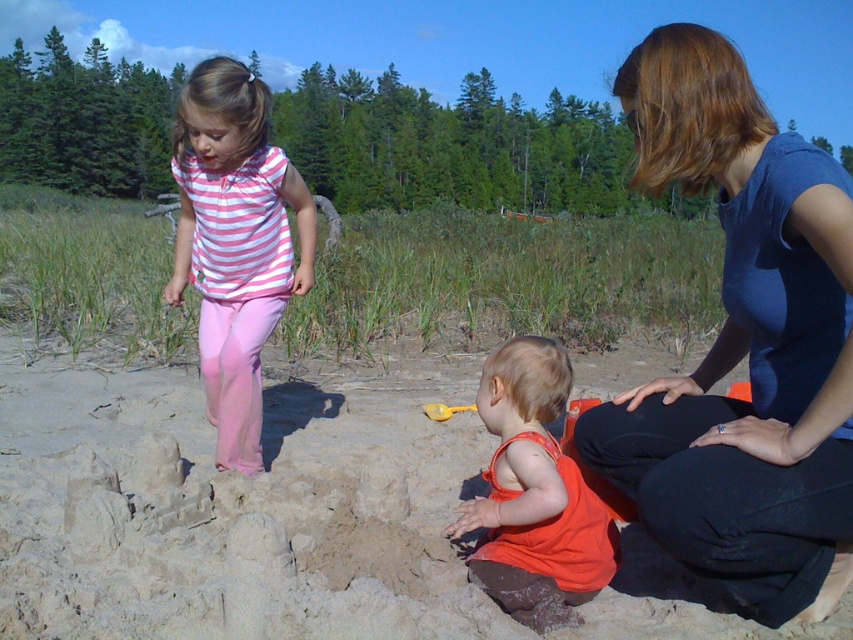
Question: Which is nearer to the orange fabric toddler at center?

Choices:
 (A) pink cotton pants at upper left
 (B) blue fabric dress at center
 (C) yellow plastic shovel at center

Answer: (B)

Question: Which of the following is the closest to the observer?

Choices:
 (A) (202, 104)
 (B) (430, 413)

Answer: (A)

Question: Is blue fabric dress at center smaller than yellow plastic shovel at center?

Choices:
 (A) no
 (B) yes

Answer: (A)

Question: Estimate the real-world distances between objects in this image. Which object is closer to the orange fabric toddler at center?

Choices:
 (A) blue fabric dress at center
 (B) pink cotton pants at upper left

Answer: (A)

Question: Is orange fabric toddler at center to the right of yellow plastic shovel at center from the viewer's perspective?

Choices:
 (A) no
 (B) yes

Answer: (B)

Question: Observing the image, what is the correct spatial positioning of blue fabric dress at center in reference to pink cotton pants at upper left?

Choices:
 (A) above
 (B) below

Answer: (B)